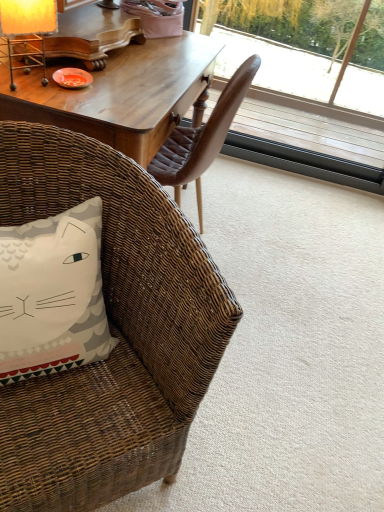
You are a GUI agent. You are given a task and a screenshot of the screen. Output one action in this format:
    pyautogui.click(x=<x>, y=<y>)
    Task: Click on the vacant area to the right of matte yellow lampshade at upper left
    This screenshot has height=512, width=384.
    Given the screenshot: What is the action you would take?
    pyautogui.click(x=94, y=90)